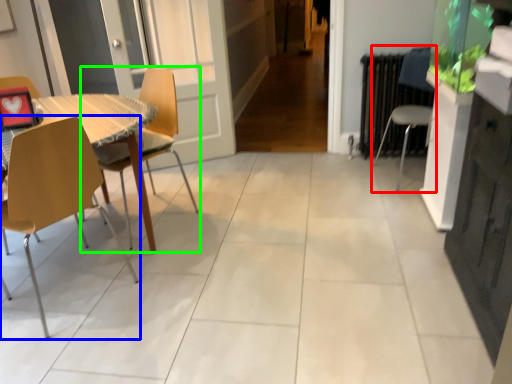
Question: Which object is positioned closest to chair (highlighted by a red box)? Select from chair (highlighted by a blue box) and chair (highlighted by a green box).

Choices:
 (A) chair
 (B) chair

Answer: (B)